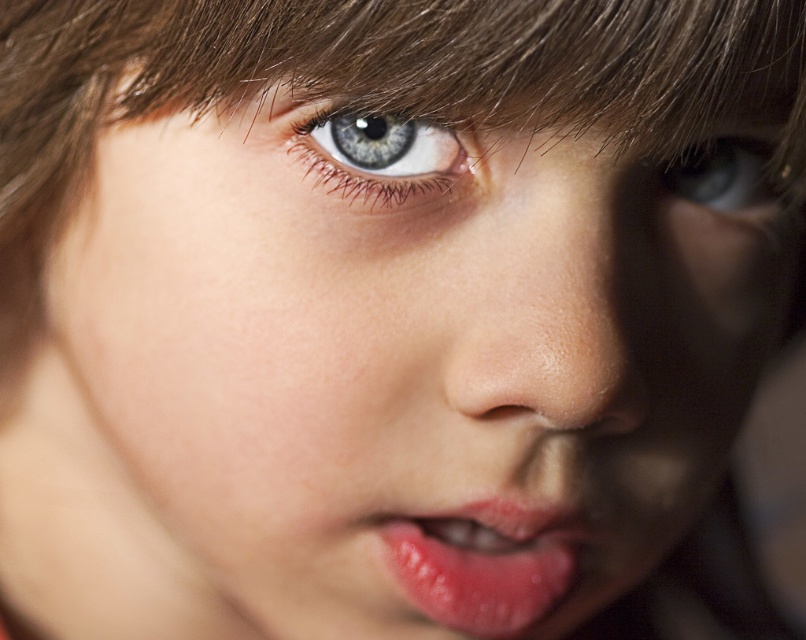
Question: Where is blue glossy eye at center located in relation to blue glossy eye at upper right in the image?

Choices:
 (A) above
 (B) below

Answer: (B)

Question: Can you confirm if glossy pink lips at center is smaller than blue glossy eye at upper right?

Choices:
 (A) no
 (B) yes

Answer: (A)

Question: Which is farther from the smooth skin nose at center?

Choices:
 (A) blue glossy eye at upper right
 (B) blue glossy eye at center

Answer: (A)

Question: Among these points, which one is farthest from the camera?

Choices:
 (A) (738, 179)
 (B) (383, 173)
 (C) (609, 163)
 (D) (403, 586)

Answer: (A)

Question: Which object is positioned farthest from the glossy pink lips at center?

Choices:
 (A) blue glossy eye at center
 (B) blue glossy eye at upper right
 (C) smooth skin nose at center

Answer: (B)

Question: Can you confirm if glossy pink lips at center is bigger than blue glossy eye at upper right?

Choices:
 (A) no
 (B) yes

Answer: (B)